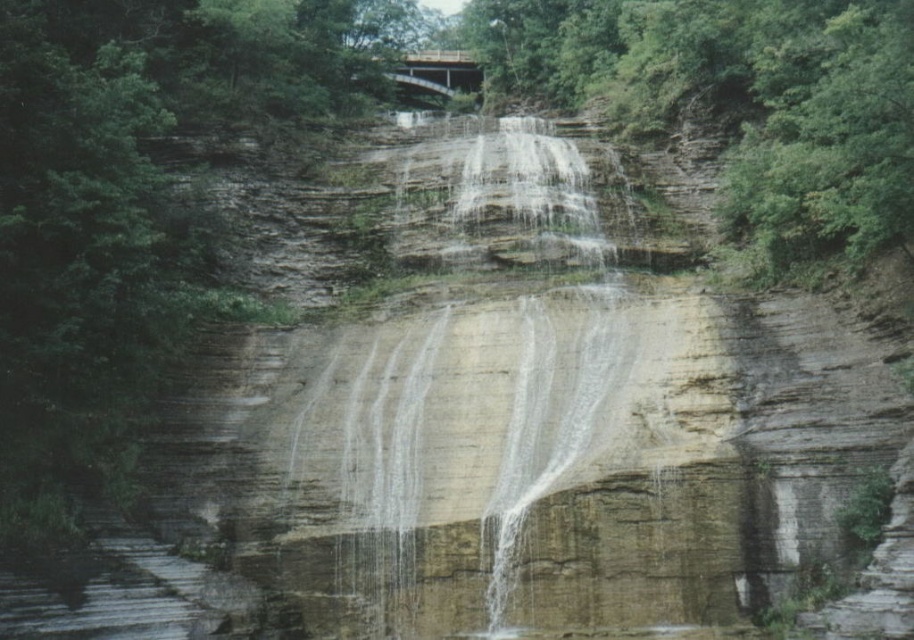
Question: Can you confirm if white textured water at center is bigger than wooden bridge at upper center?

Choices:
 (A) yes
 (B) no

Answer: (A)

Question: Is white textured water at center below wooden bridge at upper center?

Choices:
 (A) no
 (B) yes

Answer: (B)

Question: From the image, what is the correct spatial relationship of white textured water at center in relation to wooden bridge at upper center?

Choices:
 (A) below
 (B) above

Answer: (A)